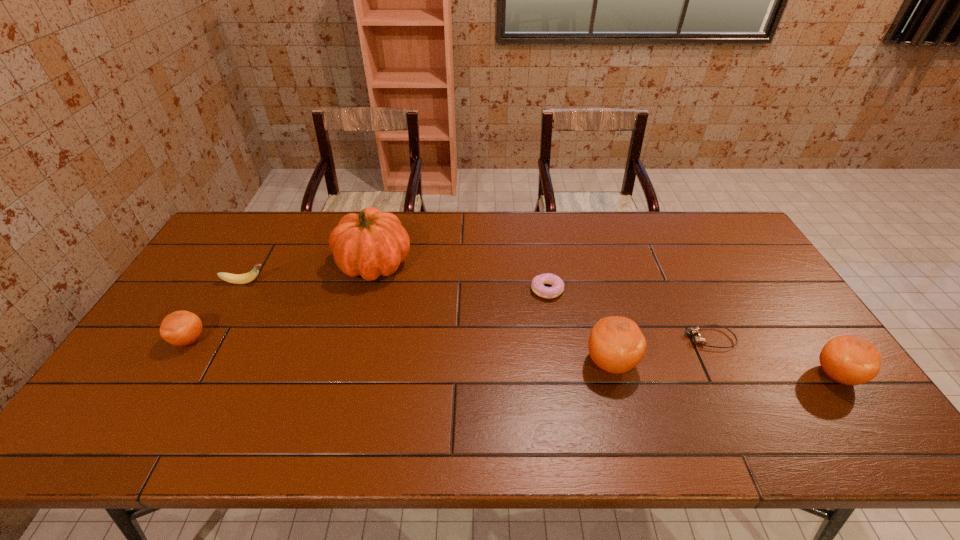
The image size is (960, 540). I want to click on the fourth tallest object, so click(x=181, y=328).

Find the location of a particular element. The height and width of the screenshot is (540, 960). the leftmost orange is located at coordinates (181, 328).

At what (x,y) coordinates should I click in order to perform the action: click on the third object from right to left. Please return your answer as a coordinate pair (x, y). Image resolution: width=960 pixels, height=540 pixels. Looking at the image, I should click on (616, 344).

Where is `the tallest orange`? the tallest orange is located at coordinates (616, 344).

Where is `the second shortest orange`? The width and height of the screenshot is (960, 540). the second shortest orange is located at coordinates (850, 360).

Where is `the fifth shortest object`? the fifth shortest object is located at coordinates (850, 360).

Image resolution: width=960 pixels, height=540 pixels. Identify the location of doughnut. (557, 283).

Locate an element on the screen. This screenshot has height=540, width=960. the fourth object from left to right is located at coordinates (557, 283).

Find the location of a particular element. The width and height of the screenshot is (960, 540). the tallest object is located at coordinates (372, 243).

Find the location of a particular element. The height and width of the screenshot is (540, 960). pumpkin is located at coordinates (372, 243).